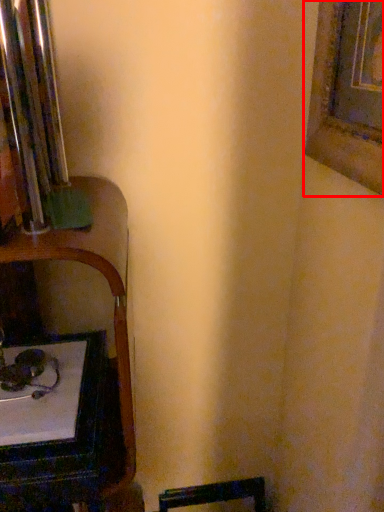
Question: Where is picture frame (annotated by the red box) located in relation to table in the image?

Choices:
 (A) right
 (B) left

Answer: (A)